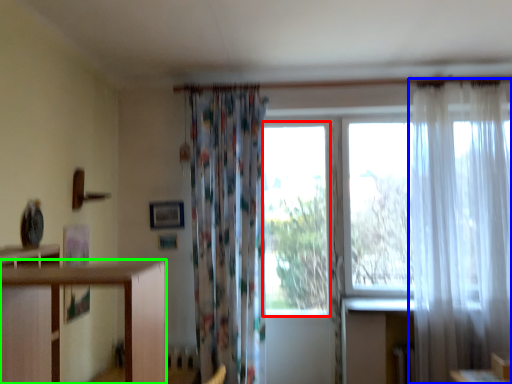
Question: Considering the real-world distances, which object is farthest from window (highlighted by a red box)? curtain (highlighted by a blue box) or furniture (highlighted by a green box)?

Choices:
 (A) curtain
 (B) furniture

Answer: (B)